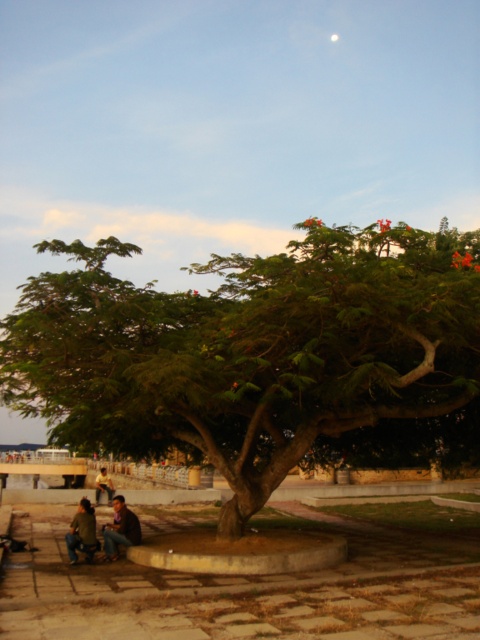
Question: Which point is farther to the camera?

Choices:
 (A) dark brown leather jacket at lower left
 (B) green leafy tree at center

Answer: (A)

Question: Can you confirm if dark green fabric couple at center is positioned below green fabric jacket at lower left?

Choices:
 (A) yes
 (B) no

Answer: (B)

Question: Does green leafy tree at center appear on the left side of green fabric jacket at lower left?

Choices:
 (A) yes
 (B) no

Answer: (B)

Question: Which of the following is the closest to the observer?

Choices:
 (A) (118, 541)
 (B) (90, 522)
 (C) (98, 499)

Answer: (A)

Question: Does dark green fabric couple at center lie in front of yellow fabric shirt at lower left?

Choices:
 (A) no
 (B) yes

Answer: (B)

Question: Which object is the closest to the yellow fabric shirt at lower left?

Choices:
 (A) dark green fabric couple at center
 (B) green leafy tree at center
 (C) green fabric jacket at lower left

Answer: (A)